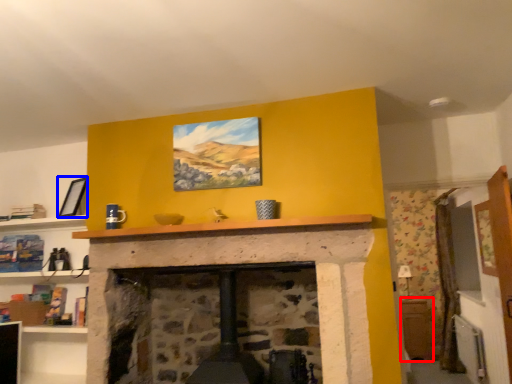
Question: Which object appears closest to the camera in this image, table (highlighted by a red box) or picture frame (highlighted by a blue box)?

Choices:
 (A) table
 (B) picture frame

Answer: (B)